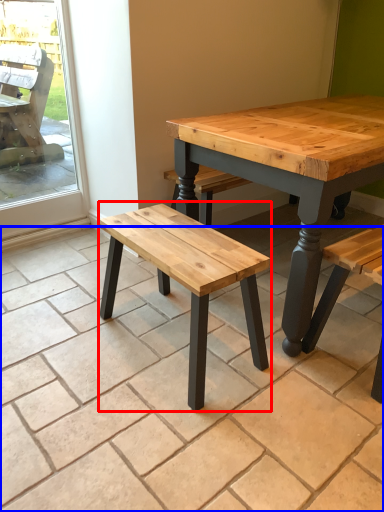
Question: Among these objects, which one is nearest to the camera, stool (highlighted by a red box) or tile (highlighted by a blue box)?

Choices:
 (A) stool
 (B) tile

Answer: (B)